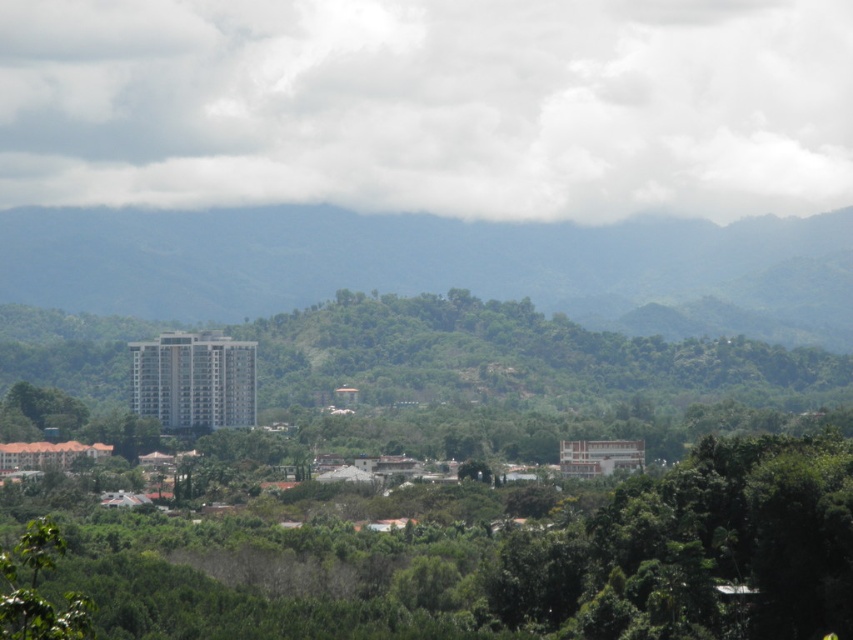
You are standing at the point marked as point (430, 106) in the image. What is the nearest object to you in the scene?

The nearest object to point (430, 106) is the white fluffy cloud at upper center because the point is located on it.

You are an architect designing a new park and want to include both a white fluffy cloud at upper center and a green leafy tree at center. Which object would require more space in the park layout?

The green leafy tree at center requires more space in the park layout because the white fluffy cloud at upper center occupies less space than it.